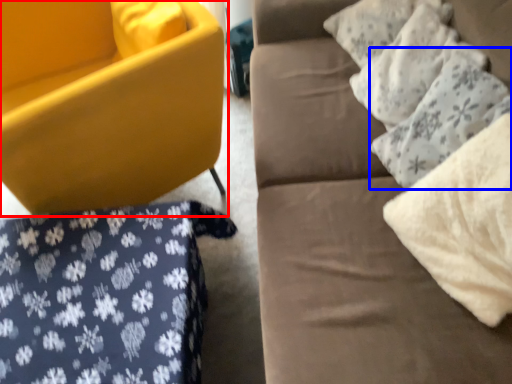
Question: Which point is further to the camera, chair (highlighted by a red box) or pillow (highlighted by a blue box)?

Choices:
 (A) chair
 (B) pillow

Answer: (A)